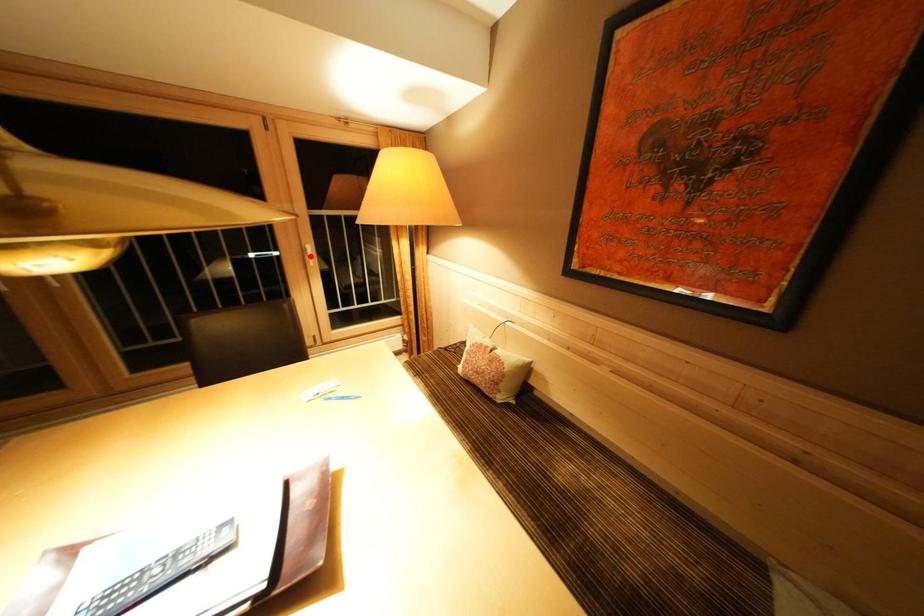
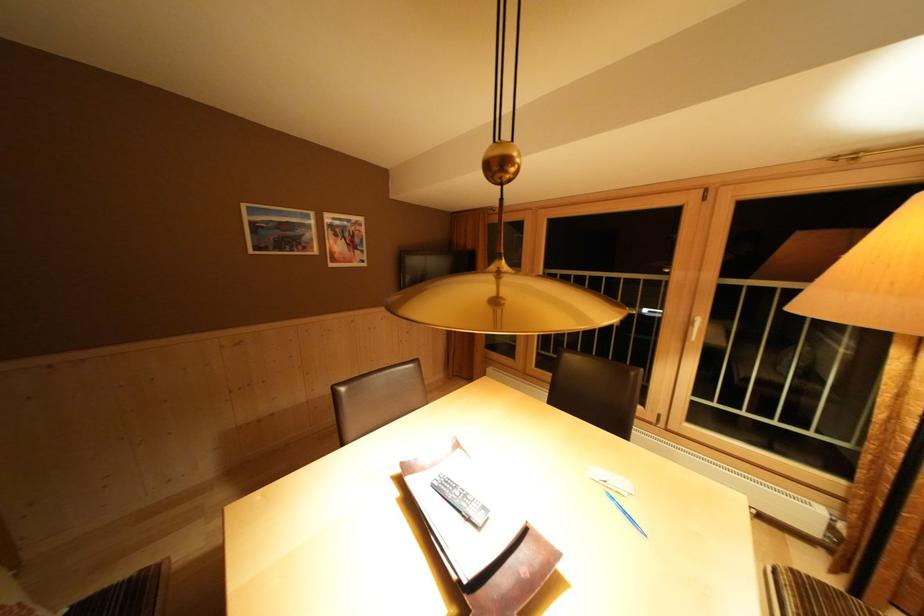
Find the pixel in the second image that matches the highlighted location in the first image.

(697, 328)